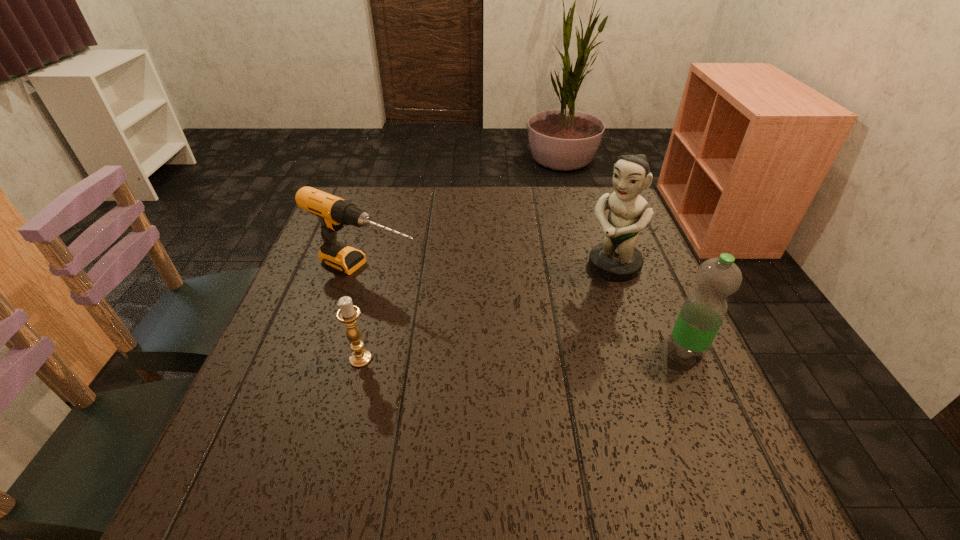
Locate an element on the screen. This screenshot has height=540, width=960. free region located 0.350m on the front-facing side of the tallest object is located at coordinates (500, 357).

Identify the location of free point located 0.190m on the front-facing side of the tallest object. The image size is (960, 540). (549, 317).

Locate an element on the screen. This screenshot has width=960, height=540. object present at the left edge is located at coordinates (334, 212).

You are a GUI agent. You are given a task and a screenshot of the screen. Output one action in this format:
    pyautogui.click(x=<x>, y=<y>)
    Task: Click on the water bottle positioned at the right edge
    This screenshot has height=540, width=960.
    Given the screenshot: What is the action you would take?
    pyautogui.click(x=704, y=309)

Identify the location of figurine located in the right edge section of the desktop. This screenshot has height=540, width=960. (616, 258).

Locate an element on the screen. free spot at the far edge of the desktop is located at coordinates (518, 191).

You are a GUI agent. You are given a task and a screenshot of the screen. Output one action in this format:
    pyautogui.click(x=<x>, y=<y>)
    Task: Click on the vacant position at the near edge of the desktop
    The image size is (960, 540).
    Given the screenshot: What is the action you would take?
    coord(332,446)

At what (x,y) coordinates should I click in order to perform the action: click on blank space at the left edge. Please return your answer as a coordinate pair (x, y). This screenshot has width=960, height=540. Looking at the image, I should click on (262, 359).

At what (x,y) coordinates should I click in order to perform the action: click on blank space at the right edge of the desktop. Please return your answer as a coordinate pair (x, y). Looking at the image, I should click on (621, 353).

The height and width of the screenshot is (540, 960). I want to click on free space at the far left corner of the desktop, so click(x=368, y=207).